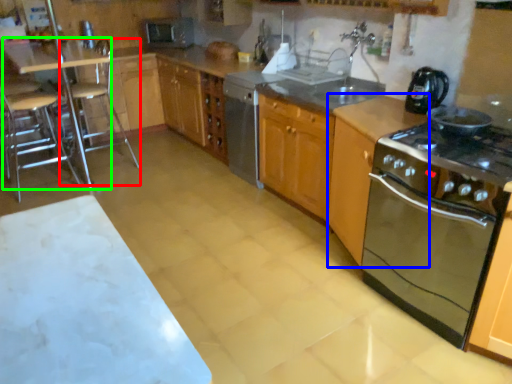
Question: Based on their relative distances, which object is nearer to bar stool (highlighted by a red box)? Choose from cabinetry (highlighted by a blue box) and table (highlighted by a green box).

Choices:
 (A) cabinetry
 (B) table

Answer: (B)